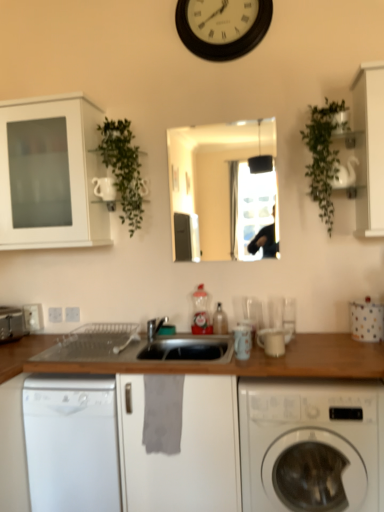
Question: Can you confirm if white matte cabinet at upper left, arranged as the 2th cabinetry when viewed from the right, is thinner than white glossy cabinet at upper right, which is counted as the 1th cabinetry, starting from the right?

Choices:
 (A) yes
 (B) no

Answer: (B)

Question: From a real-world perspective, is white matte cabinet at upper left, which ranks as the 1th cabinetry in left-to-right order, over white glossy cabinet at upper right, which is counted as the 1th cabinetry, starting from the right?

Choices:
 (A) yes
 (B) no

Answer: (B)

Question: Considering the relative sizes of white matte cabinet at upper left, which ranks as the 1th cabinetry in left-to-right order, and white glossy cabinet at upper right, which is counted as the 1th cabinetry, starting from the right, in the image provided, is white matte cabinet at upper left, which ranks as the 1th cabinetry in left-to-right order, shorter than white glossy cabinet at upper right, which is counted as the 1th cabinetry, starting from the right,?

Choices:
 (A) yes
 (B) no

Answer: (A)

Question: Is white matte cabinet at upper left, arranged as the second cabinetry when viewed from the front, taller than white glossy cabinet at upper right, the 2th cabinetry in the left-to-right sequence?

Choices:
 (A) yes
 (B) no

Answer: (B)

Question: From a real-world perspective, is white matte cabinet at upper left, arranged as the second cabinetry when viewed from the front, below white glossy cabinet at upper right, the first cabinetry in the front-to-back sequence?

Choices:
 (A) no
 (B) yes

Answer: (B)

Question: From the image's perspective, does white matte cabinet at upper left, arranged as the first cabinetry when viewed from the back, appear lower than white glossy cabinet at upper right, positioned as the second cabinetry in back-to-front order?

Choices:
 (A) yes
 (B) no

Answer: (A)

Question: Is translucent plastic bottle at center, which is the first bottle from left to right, inside white plastic electric outlet at lower left, which appears as the second electric outlet when viewed from the right?

Choices:
 (A) no
 (B) yes

Answer: (A)

Question: Can you confirm if white plastic electric outlet at lower left, acting as the 2th electric outlet starting from the left, is wider than translucent plastic bottle at center, marked as the second bottle in a right-to-left arrangement?

Choices:
 (A) no
 (B) yes

Answer: (A)

Question: Can you confirm if white plastic electric outlet at lower left, which appears as the second electric outlet when viewed from the right, is shorter than translucent plastic bottle at center, marked as the second bottle in a right-to-left arrangement?

Choices:
 (A) yes
 (B) no

Answer: (A)

Question: Is white plastic electric outlet at lower left, acting as the 2th electric outlet starting from the left, not inside translucent plastic bottle at center, marked as the second bottle in a right-to-left arrangement?

Choices:
 (A) yes
 (B) no

Answer: (A)

Question: Does white plastic electric outlet at lower left, which appears as the second electric outlet when viewed from the right, lie behind translucent plastic bottle at center, marked as the second bottle in a right-to-left arrangement?

Choices:
 (A) yes
 (B) no

Answer: (A)

Question: Is white plastic electric outlet at lower left, acting as the 2th electric outlet starting from the left, placed right next to translucent plastic bottle at center, marked as the second bottle in a right-to-left arrangement?

Choices:
 (A) no
 (B) yes

Answer: (A)

Question: Is white glossy washing machine at lower right thinner than green leafy plant at upper right, acting as the second plant starting from the left?

Choices:
 (A) no
 (B) yes

Answer: (A)